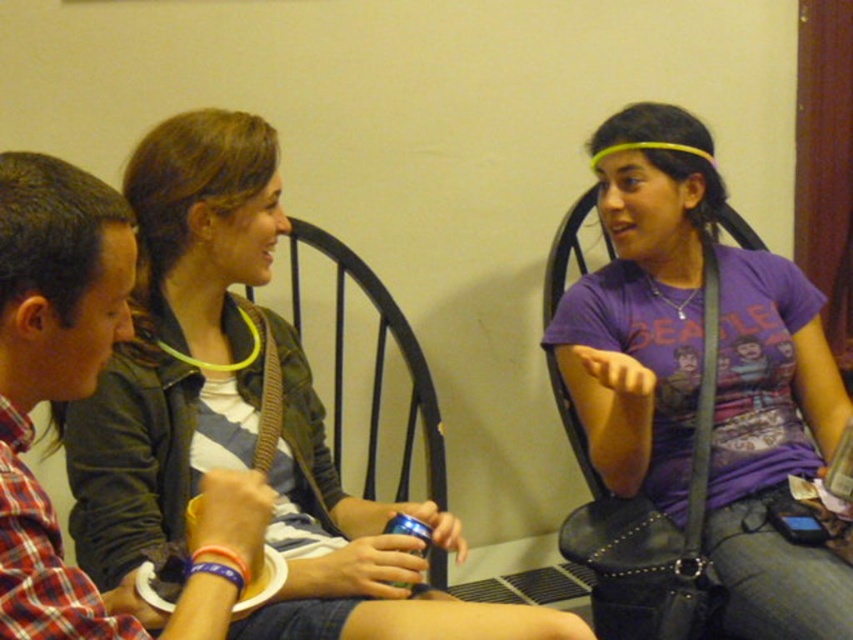
You are standing in the room and want to place a small plant between the two points, point (637, 138) and point (440, 483). Which point should the plant be closer to in order to be centered between them?

The plant should be placed closer to point (440, 483) because point (637, 138) is closer to the camera than point (440, 483), so the midpoint in 3D space would require the plant to be closer to the farther point to appear centered in the 2D image.